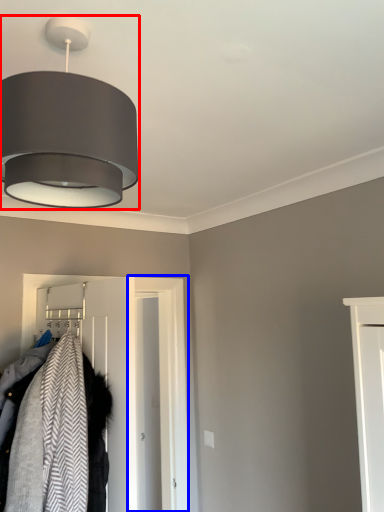
Question: Which object is closer to the camera taking this photo, lamp (highlighted by a red box) or door (highlighted by a blue box)?

Choices:
 (A) lamp
 (B) door

Answer: (A)